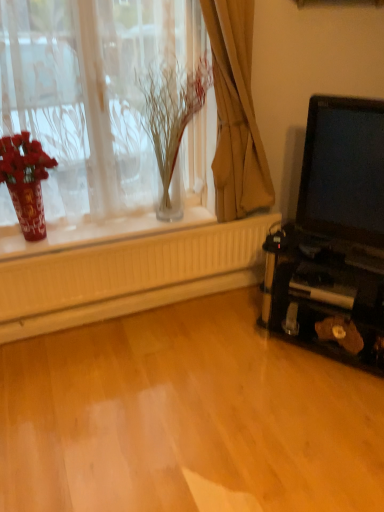
Identify the location of translucent glass vase at upper left. The height and width of the screenshot is (512, 384). (105, 113).

Image resolution: width=384 pixels, height=512 pixels. What do you see at coordinates (105, 113) in the screenshot?
I see `translucent glass vase at upper left` at bounding box center [105, 113].

The width and height of the screenshot is (384, 512). What do you see at coordinates (344, 170) in the screenshot?
I see `matte black laptop at right` at bounding box center [344, 170].

The width and height of the screenshot is (384, 512). Identify the location of shiny red vase at left. (26, 181).

Locate an element on the screen. Image resolution: width=384 pixels, height=512 pixels. translucent glass vase at upper center is located at coordinates (171, 114).

This screenshot has height=512, width=384. I want to click on translucent glass vase at upper left, so click(105, 113).

From the image's perspective, does matte black laptop at right appear lower than brown fabric curtain at upper center?

Correct, matte black laptop at right appears lower than brown fabric curtain at upper center in the image.

Is matte black laptop at right not near brown fabric curtain at upper center?

That's not correct — matte black laptop at right is a little close to brown fabric curtain at upper center.

Is matte black laptop at right facing towards brown fabric curtain at upper center?

No, matte black laptop at right is not oriented towards brown fabric curtain at upper center.

Does point (321, 231) appear closer or farther from the camera than point (261, 186)?

Point (321, 231) is closer to the camera than point (261, 186).

Does point (253, 143) come closer to viewer compared to point (380, 115)?

That is False.

Between brown fabric curtain at upper center and matte black laptop at right, which one appears on the right side from the viewer's perspective?

matte black laptop at right is more to the right.

Which of these two, brown fabric curtain at upper center or matte black laptop at right, stands shorter?

matte black laptop at right.

In the scene shown: Which object is more forward, brown fabric curtain at upper center or matte black laptop at right?

matte black laptop at right is closer to the camera.

Are brown fabric curtain at upper center and translucent glass vase at upper left far apart?

brown fabric curtain at upper center is actually quite close to translucent glass vase at upper left.

Considering the positions of objects brown fabric curtain at upper center and translucent glass vase at upper left in the image provided, who is more to the left, brown fabric curtain at upper center or translucent glass vase at upper left?

Positioned to the left is translucent glass vase at upper left.

Which of these two, brown fabric curtain at upper center or translucent glass vase at upper left, is bigger?

With larger size is translucent glass vase at upper left.

Which of these two, brown fabric curtain at upper center or translucent glass vase at upper left, is thinner?

brown fabric curtain at upper center.

Considering the positions of objects translucent glass vase at upper center and shiny red vase at left in the image provided, who is more to the left, translucent glass vase at upper center or shiny red vase at left?

From the viewer's perspective, shiny red vase at left appears more on the left side.

Is translucent glass vase at upper center facing towards shiny red vase at left?

No, translucent glass vase at upper center does not turn towards shiny red vase at left.

Based on their sizes in the image, would you say translucent glass vase at upper center is bigger or smaller than shiny red vase at left?

Considering their sizes, translucent glass vase at upper center takes up more space than shiny red vase at left.

From a real-world perspective, is translucent glass vase at upper center positioned above or below shiny red vase at left?

In terms of real-world spatial position, translucent glass vase at upper center is above shiny red vase at left.

Measure the distance between shiny red vase at left and translucent glass vase at upper left.

They are 32.59 centimeters apart.

Is shiny red vase at left in contact with translucent glass vase at upper left?

No.

Looking at this image, is shiny red vase at left turned away from translucent glass vase at upper left?

Yes, shiny red vase at left's orientation is away from translucent glass vase at upper left.

This screenshot has height=512, width=384. In the image, there is a translucent glass vase at upper left. In order to click on floral arrangement below it (from a real-world perspective) in this screenshot , I will do `click(26, 181)`.

Is matte black laptop at right positioned behind translucent glass vase at upper center?

No, the depth of matte black laptop at right is less than that of translucent glass vase at upper center.

Which object is wider, matte black laptop at right or translucent glass vase at upper center?

translucent glass vase at upper center is wider.

Can you confirm if matte black laptop at right is bigger than translucent glass vase at upper center?

Actually, matte black laptop at right might be smaller than translucent glass vase at upper center.

Considering the relative sizes of translucent glass vase at upper left and brown fabric curtain at upper center in the image provided, is translucent glass vase at upper left thinner than brown fabric curtain at upper center?

No.

How far apart are translucent glass vase at upper left and brown fabric curtain at upper center?

A distance of 16.57 inches exists between translucent glass vase at upper left and brown fabric curtain at upper center.

Could you tell me if translucent glass vase at upper left is facing brown fabric curtain at upper center?

Yes, translucent glass vase at upper left is oriented towards brown fabric curtain at upper center.

From a real-world perspective, who is located higher, translucent glass vase at upper left or brown fabric curtain at upper center?

From a 3D spatial view, translucent glass vase at upper left is above.

Where is `curtain above the matte black laptop at right (from the image's perspective)`? The width and height of the screenshot is (384, 512). curtain above the matte black laptop at right (from the image's perspective) is located at coordinates (236, 112).

Where is `laptop below the brown fabric curtain at upper center (from the image's perspective)`? laptop below the brown fabric curtain at upper center (from the image's perspective) is located at coordinates (344, 170).

Considering their positions, is shiny red vase at left positioned further to translucent glass vase at upper left than translucent glass vase at upper center?

Among the two, shiny red vase at left is located further to translucent glass vase at upper left.

Which object lies nearer to the anchor point translucent glass vase at upper center, matte black laptop at right or shiny red vase at left?

shiny red vase at left lies closer to translucent glass vase at upper center than the other object.

When comparing their distances from translucent glass vase at upper center, does brown fabric curtain at upper center or shiny red vase at left seem closer?

Based on the image, brown fabric curtain at upper center appears to be nearer to translucent glass vase at upper center.

Estimate the real-world distances between objects in this image. Which object is further from translucent glass vase at upper left, translucent glass vase at upper center or shiny red vase at left?

shiny red vase at left is further to translucent glass vase at upper left.

From the picture: From the image, which object appears to be nearer to translucent glass vase at upper center, shiny red vase at left or translucent glass vase at upper left?

Based on the image, translucent glass vase at upper left appears to be nearer to translucent glass vase at upper center.

In the scene shown: Which object lies further to the anchor point brown fabric curtain at upper center, translucent glass vase at upper center or translucent glass vase at upper left?

translucent glass vase at upper left.

Based on their spatial positions, is translucent glass vase at upper center or translucent glass vase at upper left further from matte black laptop at right?

translucent glass vase at upper left is positioned further to the anchor matte black laptop at right.

Looking at the image, which one is located further to shiny red vase at left, translucent glass vase at upper center or translucent glass vase at upper left?

translucent glass vase at upper center.

Locate an element on the screen. Image resolution: width=384 pixels, height=512 pixels. plant between shiny red vase at left and brown fabric curtain at upper center in the horizontal direction is located at coordinates (171, 114).

Locate an element on the screen. This screenshot has width=384, height=512. curtain between translucent glass vase at upper center and matte black laptop at right in the horizontal direction is located at coordinates (236, 112).

The width and height of the screenshot is (384, 512). What are the coordinates of `window between shiny red vase at left and matte black laptop at right` in the screenshot? It's located at [105, 113].

This screenshot has height=512, width=384. Identify the location of plant located between translucent glass vase at upper left and brown fabric curtain at upper center in the left-right direction. (171, 114).